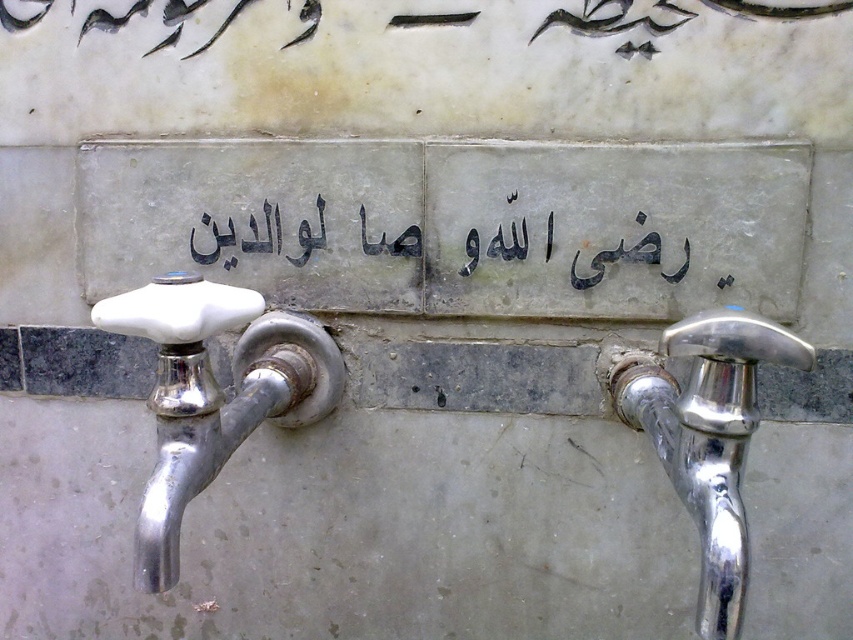
Question: Among these points, which one is farthest from the camera?

Choices:
 (A) (714, 440)
 (B) (207, 333)

Answer: (B)

Question: Which point appears farthest from the camera in this image?

Choices:
 (A) (229, 260)
 (B) (656, 388)
 (C) (251, 333)

Answer: (A)

Question: Which of the following is the farthest from the observer?

Choices:
 (A) black stone writing at center
 (B) polished chrome faucet at right
 (C) white porcelain faucet at left

Answer: (A)

Question: Can you confirm if white porcelain faucet at left is positioned below black stone writing at center?

Choices:
 (A) yes
 (B) no

Answer: (A)

Question: Does white porcelain faucet at left have a lesser width compared to polished chrome faucet at right?

Choices:
 (A) no
 (B) yes

Answer: (A)

Question: Is white porcelain faucet at left positioned at the back of polished chrome faucet at right?

Choices:
 (A) no
 (B) yes

Answer: (B)